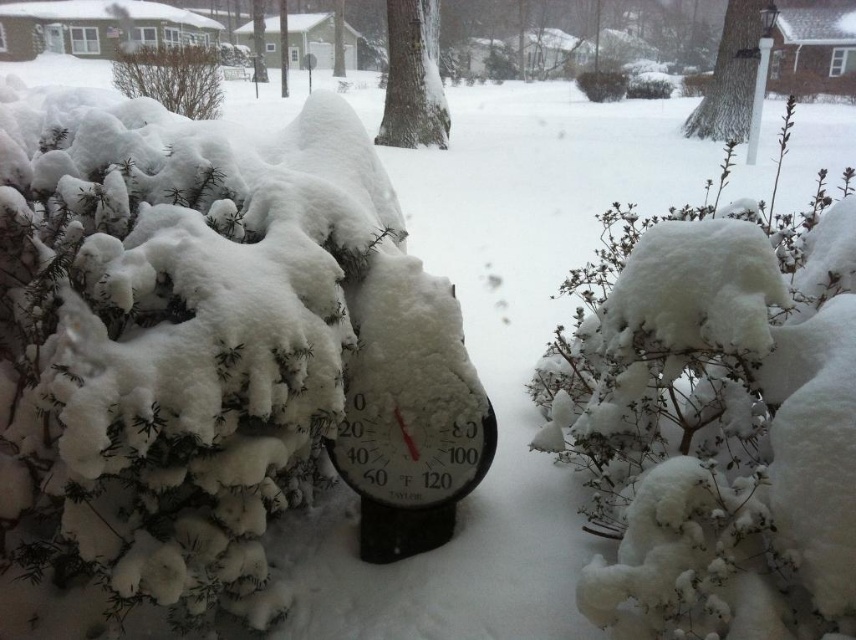
You are an observer standing in the winter scene. You notice the smooth bark tree at center and the brown textured bush at upper left. Which object would cast a longer shadow if the sun is directly in front of you?

The smooth bark tree at center is larger in size than the brown textured bush at upper left, so it would cast a longer shadow.

In the scene shown: You are an observer standing in the snowy scene. You notice two trees labeled smooth bark tree at center and smooth bark tree at upper right. Which tree is closer to you?

The smooth bark tree at center is closer to you because it is in front of the smooth bark tree at upper right.

You are standing in the winter scene and want to walk from the smooth bark tree at upper right to the brown textured bush at upper left. In which direction should you move relative to the tree?

You should move to the left relative to the smooth bark tree at upper right because the brown textured bush at upper left is located to the left of the smooth bark tree at upper right.